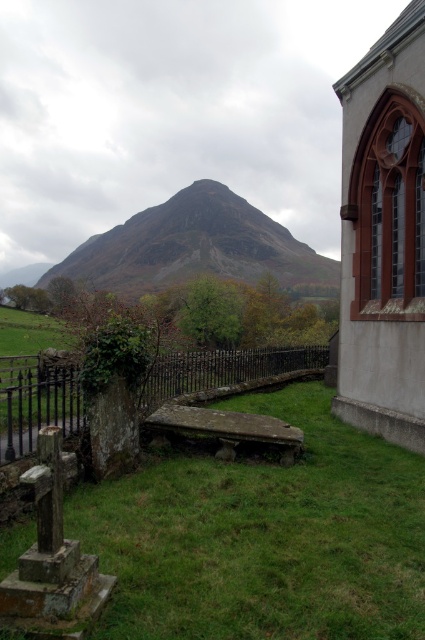
Between point (212, 228) and point (19, 428), which one is positioned behind?

The point (212, 228) is behind.

Does rustic brown mountain at center have a greater height compared to rusty metal fence at center?

Indeed, rustic brown mountain at center has a greater height compared to rusty metal fence at center.

Locate an element on the screen. rustic brown mountain at center is located at coordinates (197, 248).

At what (x,y) coordinates should I click in order to perform the action: click on rustic brown mountain at center. Please return your answer as a coordinate pair (x, y). This screenshot has width=425, height=640. Looking at the image, I should click on (197, 248).

Which of these two, smooth stone church at right or rustic brown mountain at center, stands taller?

With more height is rustic brown mountain at center.

Between smooth stone church at right and rustic brown mountain at center, which one has less height?

Standing shorter between the two is smooth stone church at right.

Image resolution: width=425 pixels, height=640 pixels. I want to click on smooth stone church at right, so click(384, 236).

Does green grassy at lower center appear on the right side of rusty metal fence at center?

Correct, you'll find green grassy at lower center to the right of rusty metal fence at center.

Which is behind, point (195, 557) or point (31, 376)?

Point (31, 376)

Locate an element on the screen. green grassy at lower center is located at coordinates (263, 536).